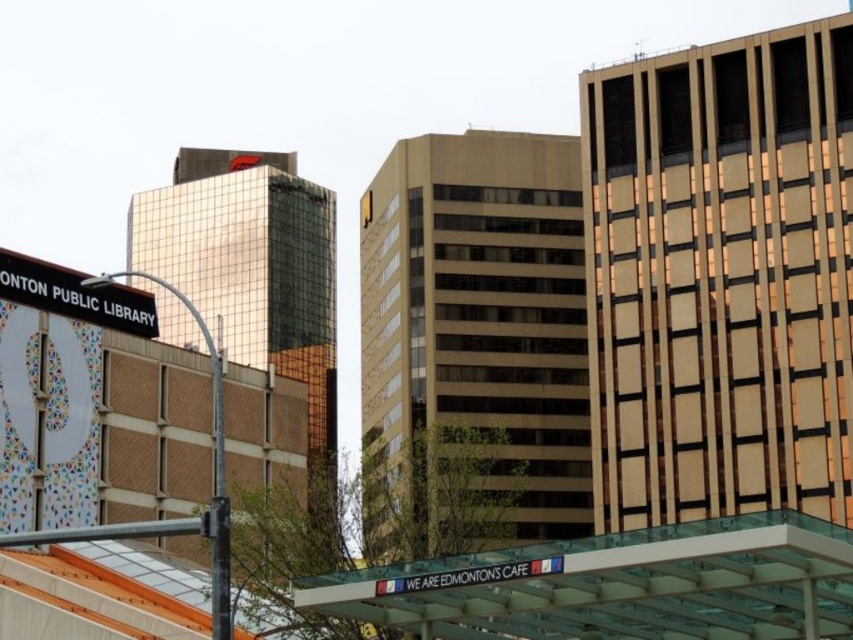
Which is more to the left, transparent glass canopy at lower center or black metal sign at upper left?

From the viewer's perspective, black metal sign at upper left appears more on the left side.

Find the location of a particular element. transparent glass canopy at lower center is located at coordinates (619, 586).

Find the location of `transparent glass canopy at lower center`. transparent glass canopy at lower center is located at coordinates (619, 586).

How distant is black metal sign at upper left from metallic pole at left?

They are 38.64 feet apart.

Is black metal sign at upper left behind metallic pole at left?

Yes, it is behind metallic pole at left.

Between point (120, 291) and point (218, 392), which one is positioned in front?

Point (218, 392)

Locate an element on the screen. The width and height of the screenshot is (853, 640). black metal sign at upper left is located at coordinates (74, 296).

Is point (842, 621) positioned before point (223, 468)?

Yes, point (842, 621) is in front of point (223, 468).

Find the location of a particular element. The height and width of the screenshot is (640, 853). transparent glass canopy at lower center is located at coordinates (619, 586).